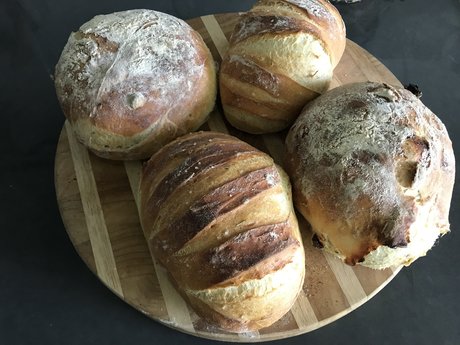
Find the location of a particular element. This screenshot has height=345, width=460. platter is located at coordinates (116, 228).